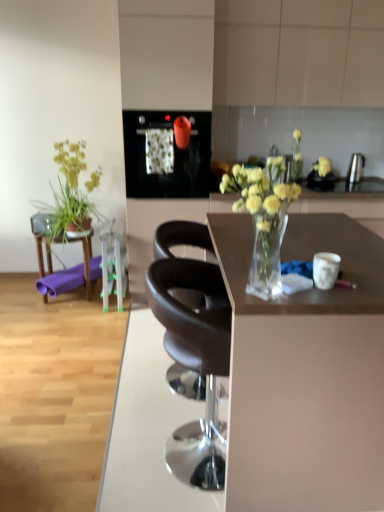
Question: Is clear glass vase at center facing away from matte black oven at upper center, which ranks as the 2th appliance in back-to-front order?

Choices:
 (A) yes
 (B) no

Answer: (B)

Question: From the image's perspective, is clear glass vase at center above matte black oven at upper center, the 1th appliance positioned from the front?

Choices:
 (A) no
 (B) yes

Answer: (A)

Question: Is clear glass vase at center far away from matte black oven at upper center, the 1th appliance positioned from the front?

Choices:
 (A) yes
 (B) no

Answer: (A)

Question: Does clear glass vase at center have a lesser height compared to matte black oven at upper center, positioned as the 2th appliance in right-to-left order?

Choices:
 (A) yes
 (B) no

Answer: (A)

Question: Is clear glass vase at center at the left side of matte black oven at upper center, which ranks as the 2th appliance in back-to-front order?

Choices:
 (A) no
 (B) yes

Answer: (A)

Question: Is the position of clear glass vase at center more distant than that of matte black oven at upper center, which is counted as the first appliance, starting from the left?

Choices:
 (A) yes
 (B) no

Answer: (B)

Question: Is clear glass vase at center not inside green leafy plant at left?

Choices:
 (A) no
 (B) yes

Answer: (B)

Question: Is clear glass vase at center wider than green leafy plant at left?

Choices:
 (A) no
 (B) yes

Answer: (B)

Question: From a real-world perspective, is clear glass vase at center physically below green leafy plant at left?

Choices:
 (A) yes
 (B) no

Answer: (B)

Question: Is clear glass vase at center placed right next to green leafy plant at left?

Choices:
 (A) yes
 (B) no

Answer: (B)

Question: Is clear glass vase at center to the left of green leafy plant at left from the viewer's perspective?

Choices:
 (A) yes
 (B) no

Answer: (B)

Question: From the image's perspective, does clear glass vase at center appear lower than green leafy plant at left?

Choices:
 (A) yes
 (B) no

Answer: (A)

Question: Considering the relative sizes of satin silver kettle at upper right, which is the 1th appliance from back to front, and purple rubber mat at left in the image provided, is satin silver kettle at upper right, which is the 1th appliance from back to front, shorter than purple rubber mat at left?

Choices:
 (A) yes
 (B) no

Answer: (A)